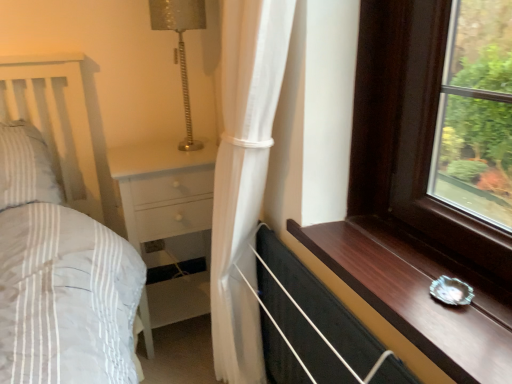
Find the location of a particular element. This screenshot has height=384, width=512. white wood chest of drawers at center is located at coordinates (164, 191).

I want to click on dark wood window sill at lower right, so click(418, 294).

Looking at this image, is dark wood window sill at lower right located within white wood chest of drawers at center?

No.

Where is `the chest of drawers below the dark wood window sill at lower right (from a real-world perspective)`? the chest of drawers below the dark wood window sill at lower right (from a real-world perspective) is located at coordinates (164, 191).

Is dark wood window sill at lower right at the back of white wood chest of drawers at center?

No, white wood chest of drawers at center is not facing away from dark wood window sill at lower right.

Which object is more forward, white wood chest of drawers at center or dark wood window sill at lower right?

dark wood window sill at lower right is in front.

Considering the sizes of objects metallic silver lamp at upper center and dark wood window sill at lower right in the image provided, who is shorter, metallic silver lamp at upper center or dark wood window sill at lower right?

Standing shorter between the two is dark wood window sill at lower right.

The width and height of the screenshot is (512, 384). What are the coordinates of `window sill on the right of metallic silver lamp at upper center` in the screenshot? It's located at (418, 294).

Between metallic silver lamp at upper center and dark wood window sill at lower right, which one appears on the left side from the viewer's perspective?

Positioned to the left is metallic silver lamp at upper center.

Does point (197, 222) appear closer or farther from the camera than point (169, 10)?

Point (197, 222) is farther from the camera than point (169, 10).

The image size is (512, 384). Find the location of `the chest of drawers below the metallic silver lamp at upper center (from the image's perspective)`. the chest of drawers below the metallic silver lamp at upper center (from the image's perspective) is located at coordinates (x=164, y=191).

Is white wood chest of drawers at center taller or shorter than metallic silver lamp at upper center?

Clearly, white wood chest of drawers at center is taller compared to metallic silver lamp at upper center.

Can we say metallic silver lamp at upper center lies outside white wood chest of drawers at center?

metallic silver lamp at upper center lies outside white wood chest of drawers at center's area.

Which object is wider, metallic silver lamp at upper center or white wood chest of drawers at center?

white wood chest of drawers at center is wider.

I want to click on lamp that is on the right side of white wood chest of drawers at center, so click(180, 46).

How far apart are metallic silver lamp at upper center and white wood chest of drawers at center?

The distance of metallic silver lamp at upper center from white wood chest of drawers at center is 13.29 inches.

Would you say dark wood window sill at lower right is a long distance from white sheer curtain at center?

No, dark wood window sill at lower right is not far from white sheer curtain at center.

Does dark wood window sill at lower right have a greater width compared to white sheer curtain at center?

Yes, dark wood window sill at lower right is wider than white sheer curtain at center.

Is dark wood window sill at lower right closer to camera compared to white sheer curtain at center?

Yes, dark wood window sill at lower right is closer to the viewer.

From a real-world perspective, which object rests below the other?

white sheer curtain at center, from a real-world perspective.

Could you tell me if dark wood window sill at lower right is turned towards metallic silver lamp at upper center?

No, dark wood window sill at lower right is not oriented towards metallic silver lamp at upper center.

Is dark wood window sill at lower right to the left or to the right of metallic silver lamp at upper center in the image?

From the image, it's evident that dark wood window sill at lower right is to the right of metallic silver lamp at upper center.

From a real-world perspective, is dark wood window sill at lower right positioned over metallic silver lamp at upper center based on gravity?

No, from a real-world perspective, dark wood window sill at lower right is not over metallic silver lamp at upper center

Is white sheer curtain at center to the left or to the right of white wood chest of drawers at center in the image?

Clearly, white sheer curtain at center is on the right of white wood chest of drawers at center in the image.

Would you say white sheer curtain at center is a long distance from white wood chest of drawers at center?

No, white sheer curtain at center is not far away from white wood chest of drawers at center.

Can you confirm if white sheer curtain at center is shorter than white wood chest of drawers at center?

Incorrect, the height of white sheer curtain at center does not fall short of that of white wood chest of drawers at center.

Between white sheer curtain at center and white wood chest of drawers at center, which one has larger width?

With larger width is white wood chest of drawers at center.

At what (x,y) coordinates should I click in order to perform the action: click on window sill on the right side of white wood chest of drawers at center. Please return your answer as a coordinate pair (x, y). Looking at the image, I should click on (418, 294).

Locate an element on the screen. window sill in front of the metallic silver lamp at upper center is located at coordinates (418, 294).

Looking at the image, which one is located further to white wood chest of drawers at center, metallic silver lamp at upper center or white sheer curtain at center?

Among the two, white sheer curtain at center is located further to white wood chest of drawers at center.

Consider the image. Based on their spatial positions, is dark wood window sill at lower right or metallic silver lamp at upper center closer to white sheer curtain at center?

dark wood window sill at lower right.

Estimate the real-world distances between objects in this image. Which object is closer to white wood chest of drawers at center, dark wood window sill at lower right or metallic silver lamp at upper center?

metallic silver lamp at upper center lies closer to white wood chest of drawers at center than the other object.

When comparing their distances from white sheer curtain at center, does metallic silver lamp at upper center or dark wood window sill at lower right seem further?

metallic silver lamp at upper center.

Considering their positions, is white wood chest of drawers at center positioned closer to metallic silver lamp at upper center than white sheer curtain at center?

white wood chest of drawers at center is closer to metallic silver lamp at upper center.

When comparing their distances from metallic silver lamp at upper center, does white sheer curtain at center or white wood chest of drawers at center seem closer?

Based on the image, white wood chest of drawers at center appears to be nearer to metallic silver lamp at upper center.

Looking at the image, which one is located further to dark wood window sill at lower right, white sheer curtain at center or white wood chest of drawers at center?

white wood chest of drawers at center is further to dark wood window sill at lower right.

Which object lies further to the anchor point dark wood window sill at lower right, white wood chest of drawers at center or white sheer curtain at center?

The object further to dark wood window sill at lower right is white wood chest of drawers at center.

This screenshot has height=384, width=512. I want to click on curtain between dark wood window sill at lower right and white wood chest of drawers at center in the front-back direction, so click(x=244, y=175).

This screenshot has width=512, height=384. I want to click on curtain located between dark wood window sill at lower right and metallic silver lamp at upper center in the depth direction, so click(244, 175).

This screenshot has height=384, width=512. Identify the location of lamp located between dark wood window sill at lower right and white wood chest of drawers at center in the depth direction. (180, 46).

The height and width of the screenshot is (384, 512). In order to click on lamp located between white sheer curtain at center and white wood chest of drawers at center in the depth direction in this screenshot , I will do `click(180, 46)`.